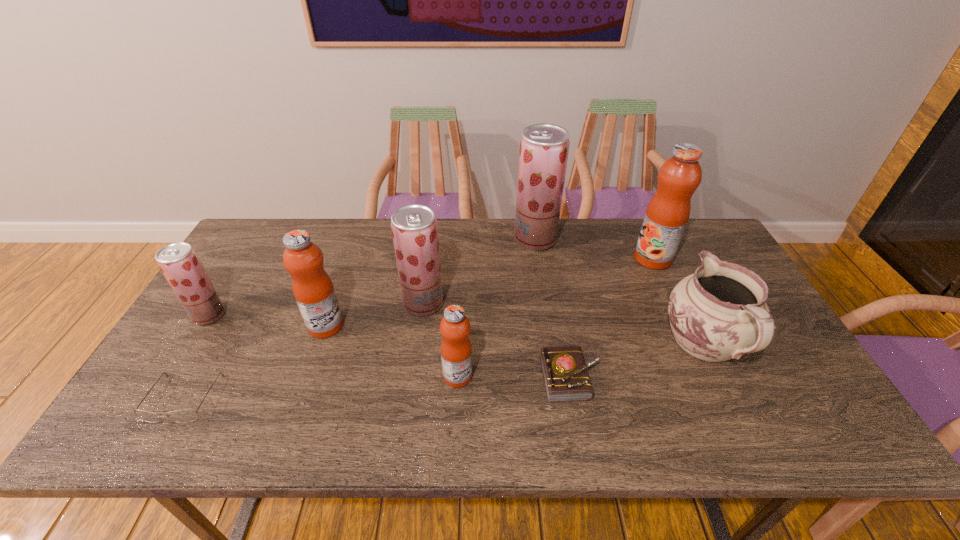
Locate which orange fruit juice ranks third in proximity to the spectacles. Please provide its 2D coordinates. Your answer should be formatted as a tuple, i.e. [(x, y)], where the tuple contains the x and y coordinates of a point satisfying the conditions above.

[(667, 214)]

In order to click on blank space that satisfies the following two spatial constraints: 1. on the front label of the second fruit juice from left to right; 2. on the right side of the diary in this screenshot , I will do `click(308, 377)`.

The image size is (960, 540). What are the coordinates of `free space that satisfies the following two spatial constraints: 1. on the front label of the second nearest orange fruit juice; 2. on the front-facing side of the beige spectacles` in the screenshot? It's located at (300, 399).

This screenshot has width=960, height=540. I want to click on vacant area that satisfies the following two spatial constraints: 1. on the front label of the second biggest orange fruit juice; 2. on the spout of the pitcher, so click(319, 345).